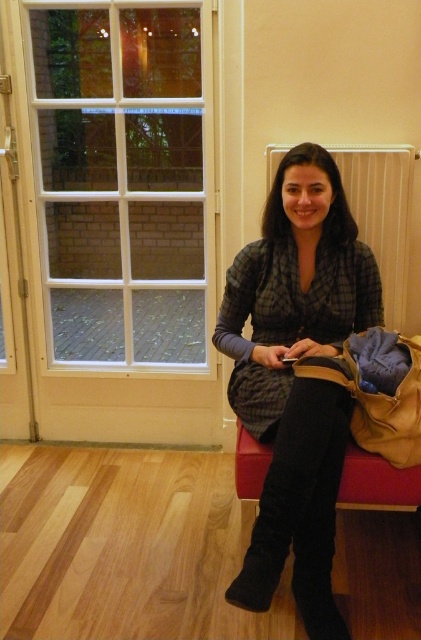
Question: Is matte plaid dress at center to the right of white textured radiator at upper center from the viewer's perspective?

Choices:
 (A) yes
 (B) no

Answer: (B)

Question: Which is nearer to the brown leather bag at lower center?

Choices:
 (A) leather-like stool at lower center
 (B) white textured radiator at upper center
 (C) matte plaid dress at center

Answer: (A)

Question: Is matte plaid dress at center wider than brown leather bag at lower center?

Choices:
 (A) yes
 (B) no

Answer: (A)

Question: Which object is positioned closest to the leather-like stool at lower center?

Choices:
 (A) brown leather bag at lower center
 (B) white textured radiator at upper center

Answer: (A)

Question: Can you confirm if white textured radiator at upper center is wider than leather-like stool at lower center?

Choices:
 (A) yes
 (B) no

Answer: (A)

Question: Which point is farther to the camera?

Choices:
 (A) (378, 486)
 (B) (261, 440)
 (C) (266, 157)

Answer: (C)